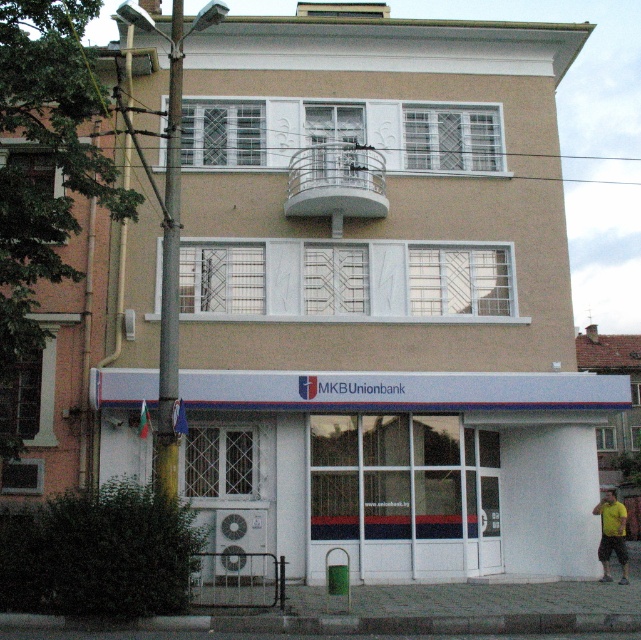
Looking at this image, does white glossy storefront at center appear on the left side of yellow t-shirt at lower right?

Indeed, white glossy storefront at center is positioned on the left side of yellow t-shirt at lower right.

Which is below, white glossy storefront at center or yellow t-shirt at lower right?

yellow t-shirt at lower right is below.

What do you see at coordinates (410, 467) in the screenshot?
I see `white glossy storefront at center` at bounding box center [410, 467].

I want to click on white glossy storefront at center, so click(x=410, y=467).

Does white glossy storefront at center have a lesser height compared to green painted metal pole at left?

Correct, white glossy storefront at center is not as tall as green painted metal pole at left.

Can you confirm if white glossy storefront at center is positioned to the left of green painted metal pole at left?

Correct, you'll find white glossy storefront at center to the left of green painted metal pole at left.

Is point (340, 508) more distant than point (171, 148)?

That is True.

At what (x,y) coordinates should I click in order to perform the action: click on white glossy storefront at center. Please return your answer as a coordinate pair (x, y). Image resolution: width=641 pixels, height=640 pixels. Looking at the image, I should click on (410, 467).

Can you confirm if green painted metal pole at left is thinner than yellow t-shirt at lower right?

Yes, green painted metal pole at left is thinner than yellow t-shirt at lower right.

Find the location of a particular element. The height and width of the screenshot is (640, 641). green painted metal pole at left is located at coordinates (171, 273).

You are a GUI agent. You are given a task and a screenshot of the screen. Output one action in this format:
    pyautogui.click(x=<x>, y=<y>)
    Task: Click on the green painted metal pole at left
    
    Given the screenshot: What is the action you would take?
    pyautogui.click(x=171, y=273)